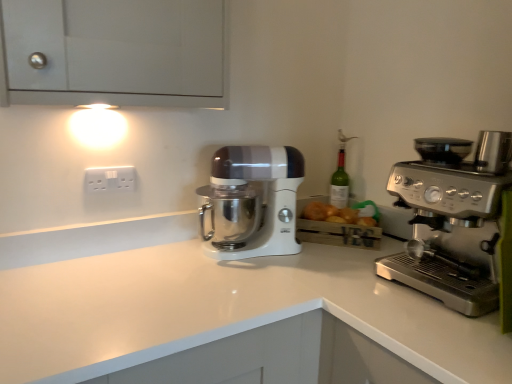
Question: Is white matte cabinet at upper left positioned in front of white plastic electrical outlet at upper left?

Choices:
 (A) no
 (B) yes

Answer: (B)

Question: From the image's perspective, would you say white matte cabinet at upper left is positioned over white plastic electrical outlet at upper left?

Choices:
 (A) no
 (B) yes

Answer: (B)

Question: Can you confirm if white matte cabinet at upper left is positioned to the right of white plastic electrical outlet at upper left?

Choices:
 (A) yes
 (B) no

Answer: (A)

Question: From a real-world perspective, is white matte cabinet at upper left physically above white plastic electrical outlet at upper left?

Choices:
 (A) yes
 (B) no

Answer: (A)

Question: Considering the relative sizes of white matte cabinet at upper left and white plastic electrical outlet at upper left in the image provided, is white matte cabinet at upper left shorter than white plastic electrical outlet at upper left?

Choices:
 (A) yes
 (B) no

Answer: (B)

Question: Does white matte cabinet at upper left have a smaller size compared to white plastic electrical outlet at upper left?

Choices:
 (A) no
 (B) yes

Answer: (A)

Question: Can you confirm if white matte cabinet at upper left is thinner than white glossy countertop at center?

Choices:
 (A) no
 (B) yes

Answer: (B)

Question: From the image's perspective, is white matte cabinet at upper left located above white glossy countertop at center?

Choices:
 (A) yes
 (B) no

Answer: (A)

Question: From a real-world perspective, is white matte cabinet at upper left on white glossy countertop at center?

Choices:
 (A) yes
 (B) no

Answer: (A)

Question: Does white matte cabinet at upper left have a greater width compared to white glossy countertop at center?

Choices:
 (A) yes
 (B) no

Answer: (B)

Question: Can you confirm if white matte cabinet at upper left is bigger than white glossy countertop at center?

Choices:
 (A) no
 (B) yes

Answer: (A)

Question: Is white matte cabinet at upper left in front of white glossy countertop at center?

Choices:
 (A) no
 (B) yes

Answer: (A)

Question: Can you confirm if satin silver espresso machine at right is positioned to the right of white plastic electrical outlet at upper left?

Choices:
 (A) yes
 (B) no

Answer: (A)